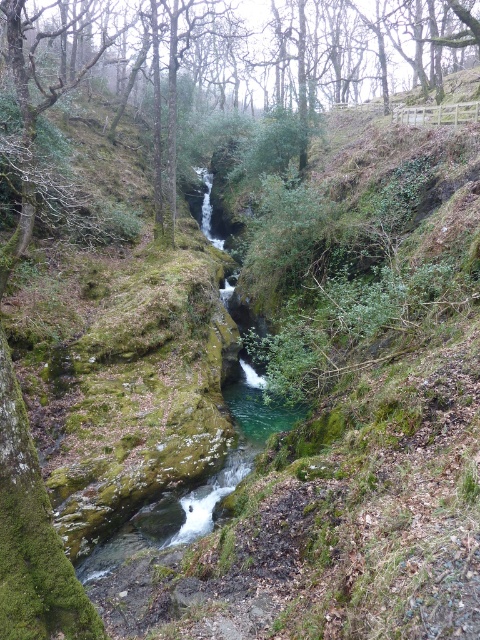
The width and height of the screenshot is (480, 640). Describe the element at coordinates (225, 67) in the screenshot. I see `green mossy tree at center` at that location.

Looking at this image, how far apart are green mossy tree at center and clear water at center?

The distance of green mossy tree at center from clear water at center is 26.74 meters.

The height and width of the screenshot is (640, 480). I want to click on green mossy tree at center, so click(x=225, y=67).

Find the location of a particular element. The image size is (480, 640). green mossy tree at center is located at coordinates (225, 67).